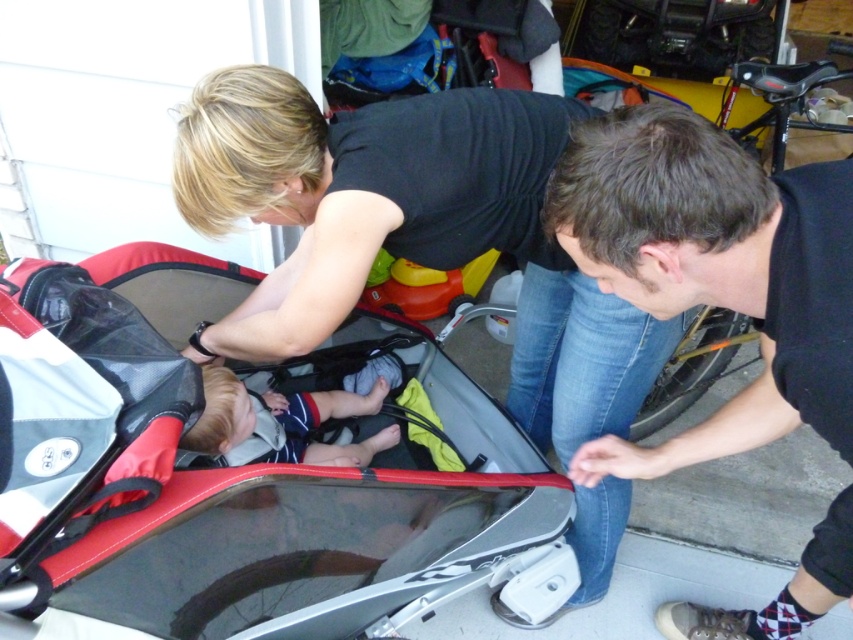
Can you confirm if red plastic baby carriage at center is positioned above dark brown hair at lower right?

Actually, red plastic baby carriage at center is below dark brown hair at lower right.

Which is behind, point (334, 355) or point (640, 227)?

The point (334, 355) is behind.

Where is `red plastic baby carriage at center`? The height and width of the screenshot is (640, 853). red plastic baby carriage at center is located at coordinates (244, 474).

Is dark brown hair at lower right taller than soft beige fabric baby at center?

Correct, dark brown hair at lower right is much taller as soft beige fabric baby at center.

Is dark brown hair at lower right smaller than soft beige fabric baby at center?

Incorrect, dark brown hair at lower right is not smaller in size than soft beige fabric baby at center.

Which is behind, point (846, 228) or point (364, 445)?

The point (364, 445) is more distant.

The height and width of the screenshot is (640, 853). Find the location of `dark brown hair at lower right`. dark brown hair at lower right is located at coordinates (714, 269).

Is red plastic baby carriage at center below soft beige fabric baby at center?

Correct, red plastic baby carriage at center is located below soft beige fabric baby at center.

Is red plastic baby carriage at center closer to camera compared to soft beige fabric baby at center?

Yes, it is in front of soft beige fabric baby at center.

Where is `red plastic baby carriage at center`? The image size is (853, 640). red plastic baby carriage at center is located at coordinates (244, 474).

This screenshot has width=853, height=640. I want to click on red plastic baby carriage at center, so click(244, 474).